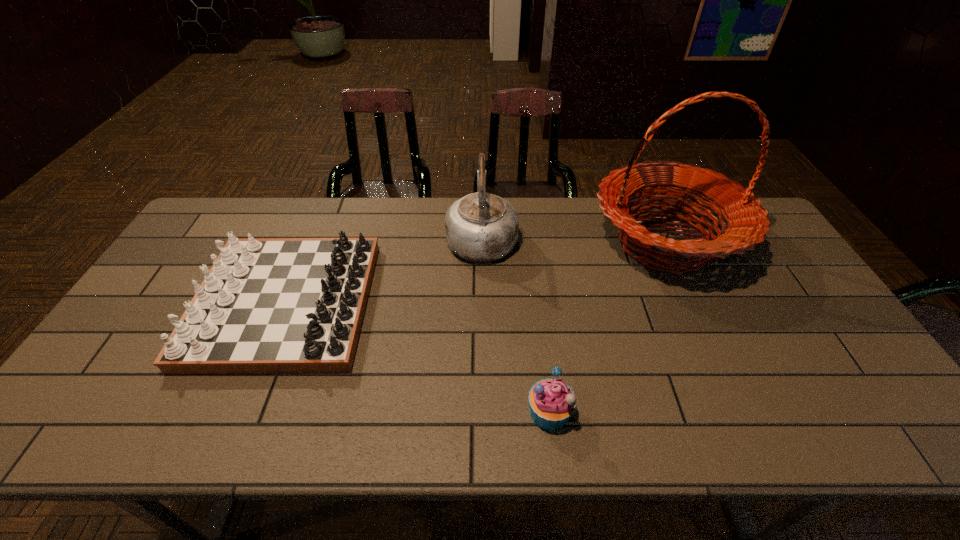
Image resolution: width=960 pixels, height=540 pixels. In the image, there is a desktop. What are the coordinates of `vacant area at the near right corner` in the screenshot? It's located at (855, 435).

At what (x,y) coordinates should I click in order to perform the action: click on vacant space in between the leftmost object and the rightmost object. Please return your answer as a coordinate pair (x, y). The height and width of the screenshot is (540, 960). Looking at the image, I should click on (475, 274).

I want to click on free space between the gameboard and the nearest object, so click(x=418, y=358).

Find the location of `vacant space in between the muffin and the leftmost object`. vacant space in between the muffin and the leftmost object is located at coordinates (418, 358).

You are a GUI agent. You are given a task and a screenshot of the screen. Output one action in this format:
    pyautogui.click(x=<x>, y=<y>)
    Task: Click on the vacant space that is in between the rightmost object and the kettle
    The width and height of the screenshot is (960, 540).
    Given the screenshot: What is the action you would take?
    pyautogui.click(x=573, y=240)

Where is `unoccupied position between the third shortest object and the muffin`? unoccupied position between the third shortest object and the muffin is located at coordinates (516, 325).

Locate an element on the screen. vacant space that's between the muffin and the basket is located at coordinates (608, 327).

Where is `vacant point located between the tallest object and the gameboard`? vacant point located between the tallest object and the gameboard is located at coordinates (475, 274).

The image size is (960, 540). I want to click on free space between the basket and the leftmost object, so click(x=475, y=274).

Image resolution: width=960 pixels, height=540 pixels. Find the location of `vacant area that lies between the leftmost object and the muffin`. vacant area that lies between the leftmost object and the muffin is located at coordinates (418, 358).